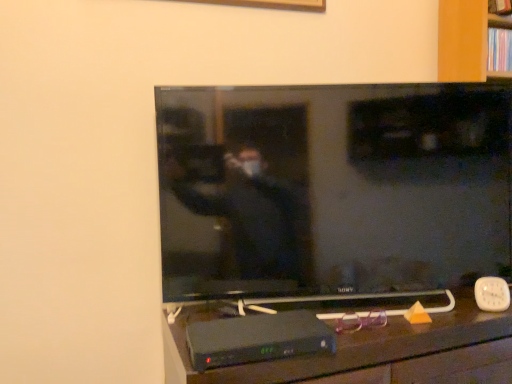
Question: Based on their sizes in the image, would you say flat screen tv at center is bigger or smaller than black plastic tv stand at lower center?

Choices:
 (A) big
 (B) small

Answer: (B)

Question: Considering the positions of flat screen tv at center and black plastic tv stand at lower center in the image, is flat screen tv at center taller or shorter than black plastic tv stand at lower center?

Choices:
 (A) short
 (B) tall

Answer: (B)

Question: Estimate the real-world distances between objects in this image. Which object is farther from the flat screen tv at center?

Choices:
 (A) wooden bookshelf at upper right
 (B) black plastic tv stand at lower center

Answer: (A)

Question: Estimate the real-world distances between objects in this image. Which object is closer to the black plastic tv stand at lower center?

Choices:
 (A) flat screen tv at center
 (B) wooden bookshelf at upper right

Answer: (A)